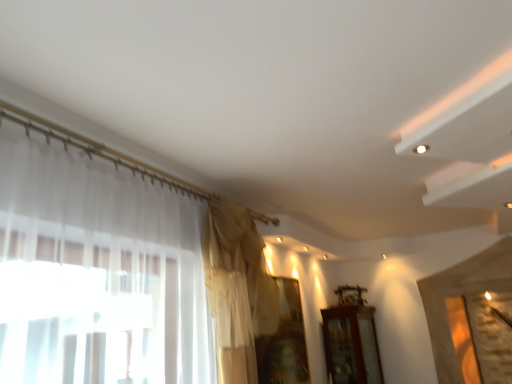
Measure the distance between point (230, 341) and camera.

Point (230, 341) and camera are 2.26 meters apart.

At what (x,y) coordinates should I click in order to perform the action: click on transparent fabric at center. Please return your answer as a coordinate pair (x, y). Looking at the image, I should click on (284, 340).

In order to face transparent fabric at center, should I rotate leftwards or rightwards?

Rotate your view right by about 3.171°.

Locate an element on the screen. The width and height of the screenshot is (512, 384). silky beige curtain at upper center is located at coordinates click(237, 288).

In the image, is transparent fabric at center positioned in front of or behind silky beige curtain at upper center?

Clearly, transparent fabric at center is behind silky beige curtain at upper center.

Based on the photo, can you confirm if transparent fabric at center is wider than silky beige curtain at upper center?

Incorrect, the width of transparent fabric at center does not surpass that of silky beige curtain at upper center.

In the scene shown: Is transparent fabric at center smaller than silky beige curtain at upper center?

Correct, transparent fabric at center occupies less space than silky beige curtain at upper center.

From the image's perspective, between brown wooden cabinet at lower right and transparent fabric at center, which one is located above?

transparent fabric at center.

Can you confirm if brown wooden cabinet at lower right is shorter than transparent fabric at center?

Yes.

Is point (364, 312) positioned before point (290, 286)?

That is False.

Is point (257, 311) closer or farther from the camera than point (348, 366)?

Point (257, 311) is positioned closer to the camera compared to point (348, 366).

From a real-world perspective, which is physically below, silky beige curtain at upper center or brown wooden cabinet at lower right?

In real-world perspective, brown wooden cabinet at lower right is lower.

In terms of width, does silky beige curtain at upper center look wider or thinner when compared to brown wooden cabinet at lower right?

silky beige curtain at upper center is thinner than brown wooden cabinet at lower right.

Would you consider brown wooden cabinet at lower right to be distant from silky beige curtain at upper center?

Yes.

Is brown wooden cabinet at lower right spatially inside silky beige curtain at upper center, or outside of it?

brown wooden cabinet at lower right is outside silky beige curtain at upper center.

Which of these two, brown wooden cabinet at lower right or silky beige curtain at upper center, stands shorter?

brown wooden cabinet at lower right.

Is transparent fabric at center to the right of brown wooden cabinet at lower right from the viewer's perspective?

In fact, transparent fabric at center is to the left of brown wooden cabinet at lower right.

Is brown wooden cabinet at lower right completely or partially inside transparent fabric at center?

No, transparent fabric at center does not contain brown wooden cabinet at lower right.

Is transparent fabric at center positioned with its back to brown wooden cabinet at lower right?

No.

Considering the relative sizes of transparent fabric at center and brown wooden cabinet at lower right in the image provided, is transparent fabric at center bigger than brown wooden cabinet at lower right?

Actually, transparent fabric at center might be smaller than brown wooden cabinet at lower right.

Considering the positions of objects silky beige curtain at upper center and transparent fabric at center in the image provided, who is more to the right, silky beige curtain at upper center or transparent fabric at center?

transparent fabric at center is more to the right.

From a real-world perspective, is silky beige curtain at upper center located higher than transparent fabric at center?

Yes.

Based on the photo, is silky beige curtain at upper center in front of transparent fabric at center?

Yes, silky beige curtain at upper center is closer to the viewer.

Looking at the image, does silky beige curtain at upper center seem bigger or smaller compared to transparent fabric at center?

Considering their sizes, silky beige curtain at upper center takes up more space than transparent fabric at center.

Locate an element on the screen. curtain that appears in front of the transparent fabric at center is located at coordinates (237, 288).

This screenshot has height=384, width=512. What are the coordinates of `window above the brown wooden cabinet at lower right (from the image's perspective)` in the screenshot? It's located at (284, 340).

Based on the photo, which object lies further to the anchor point brown wooden cabinet at lower right, transparent fabric at center or silky beige curtain at upper center?

silky beige curtain at upper center is positioned further to the anchor brown wooden cabinet at lower right.

From the image, which object appears to be farther from silky beige curtain at upper center, transparent fabric at center or brown wooden cabinet at lower right?

Among the two, brown wooden cabinet at lower right is located further to silky beige curtain at upper center.

Which object lies nearer to the anchor point transparent fabric at center, silky beige curtain at upper center or brown wooden cabinet at lower right?

silky beige curtain at upper center.

Based on the photo, estimate the real-world distances between objects in this image. Which object is further from transparent fabric at center, brown wooden cabinet at lower right or silky beige curtain at upper center?

The object further to transparent fabric at center is brown wooden cabinet at lower right.

Looking at the image, which one is located further to brown wooden cabinet at lower right, silky beige curtain at upper center or transparent fabric at center?

silky beige curtain at upper center lies further to brown wooden cabinet at lower right than the other object.

Looking at the image, which one is located closer to silky beige curtain at upper center, brown wooden cabinet at lower right or transparent fabric at center?

transparent fabric at center.

The image size is (512, 384). Find the location of `window between silky beige curtain at upper center and brown wooden cabinet at lower right along the z-axis`. window between silky beige curtain at upper center and brown wooden cabinet at lower right along the z-axis is located at coordinates (284, 340).